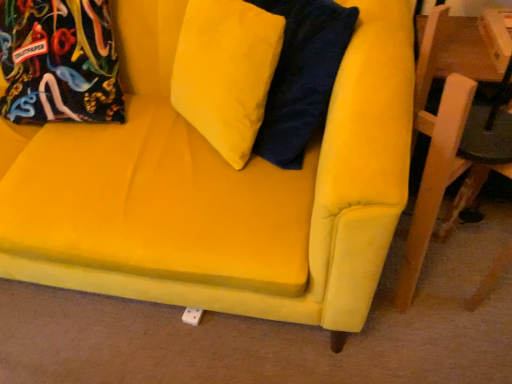
Identify the location of free space in front of wooden chair at right. This screenshot has width=512, height=384. (436, 343).